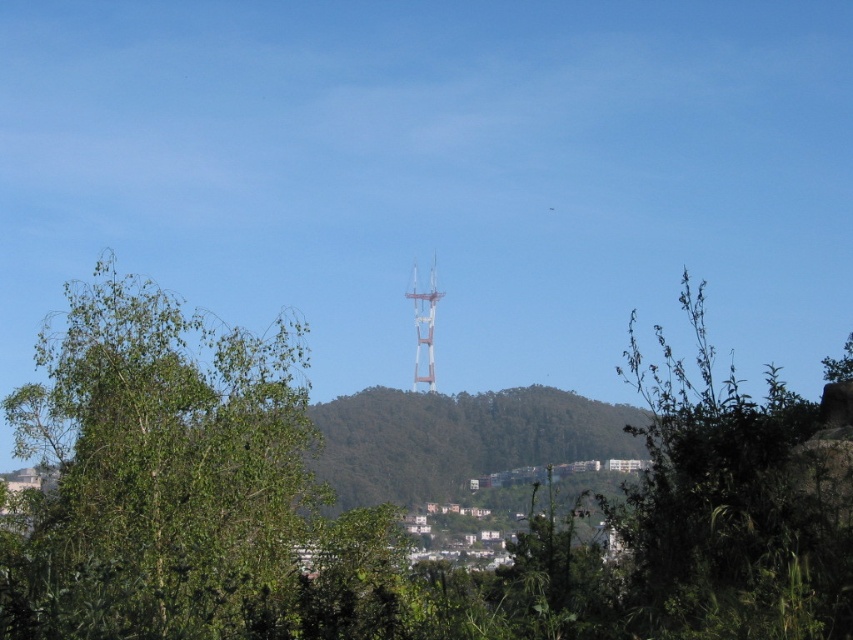
Is green leafy tree at center taller than green leafy bush at center?

Yes, green leafy tree at center is taller than green leafy bush at center.

Is point (210, 593) closer to viewer compared to point (775, 561)?

Yes.

At what (x,y) coordinates should I click in order to perform the action: click on green leafy tree at center. Please return your answer as a coordinate pair (x, y). The height and width of the screenshot is (640, 853). Looking at the image, I should click on (157, 467).

Is green leafy tree at center positioned in front of metallic silver tower at center?

Yes, it is in front of metallic silver tower at center.

What do you see at coordinates (157, 467) in the screenshot?
I see `green leafy tree at center` at bounding box center [157, 467].

The height and width of the screenshot is (640, 853). In order to click on green leafy tree at center in this screenshot , I will do `click(157, 467)`.

Is green leafy bush at center below metallic silver tower at center?

Yes, green leafy bush at center is below metallic silver tower at center.

Is green leafy bush at center to the left of metallic silver tower at center from the viewer's perspective?

Incorrect, green leafy bush at center is not on the left side of metallic silver tower at center.

Which is behind, point (830, 596) or point (422, 323)?

Positioned behind is point (422, 323).

The image size is (853, 640). Identify the location of green leafy bush at center. (722, 504).